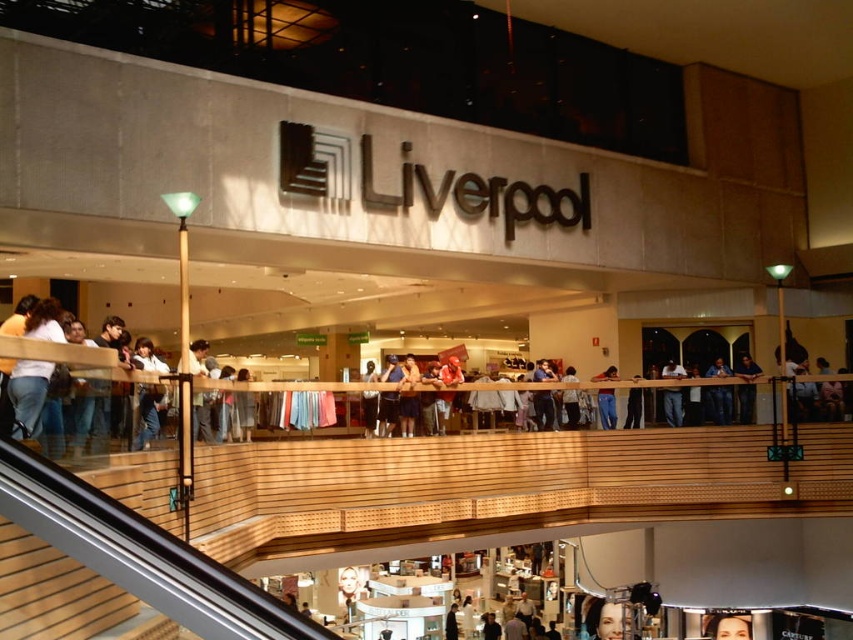
You are a customer standing on the upper level of the Liverpool store looking down. You see the light brown wooden railing at center and the dark blue jeans at center. Which object is positioned to the right from your viewpoint?

The light brown wooden railing at center is to the right of the dark blue jeans at center from your viewpoint.